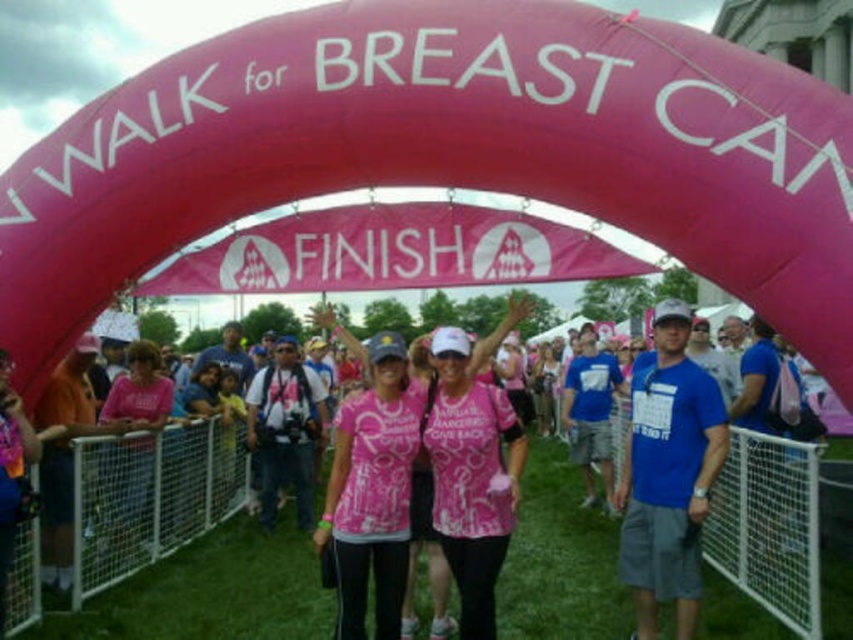
You are a photographer standing at the finish line of the breast cancer awareness walk. You want to take a photo that includes both the pink fabric people at center and the pink matte shirt at center. Given that your camera has a maximum focus range of 40 feet, will you be able to capture both subjects in focus?

The pink fabric people at center and pink matte shirt at center are 40.14 feet apart from each other. Since the distance between them exceeds the camera maximum focus range of 40 feet, the photographer will not be able to capture both subjects in focus.

You are a photographer at the breast cancer awareness walk. You want to take a photo of the pink fabric people at center. Where should you position your camera to capture them clearly?

The pink fabric people at center are located at point (x=213, y=593), so you should position your camera at that coordinate to capture them clearly.